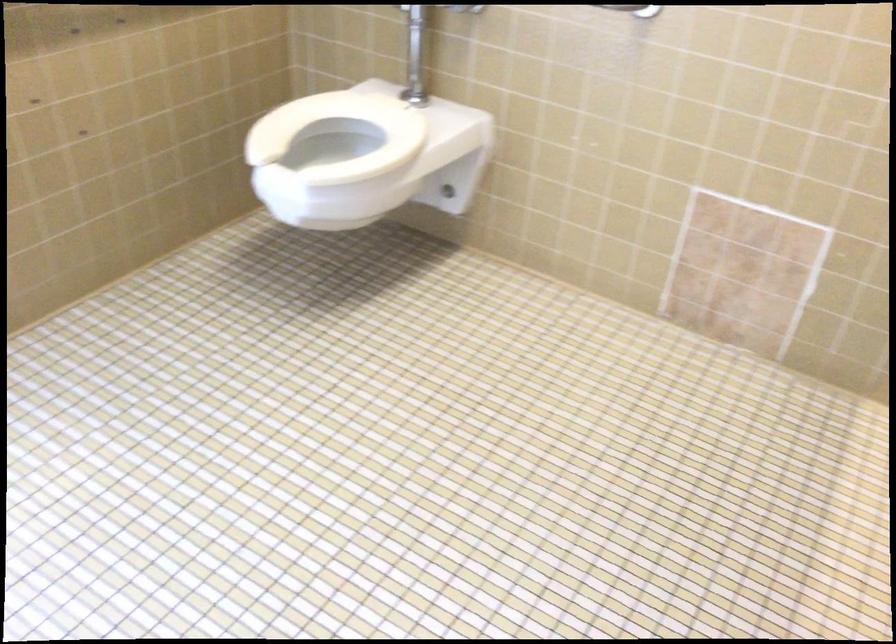
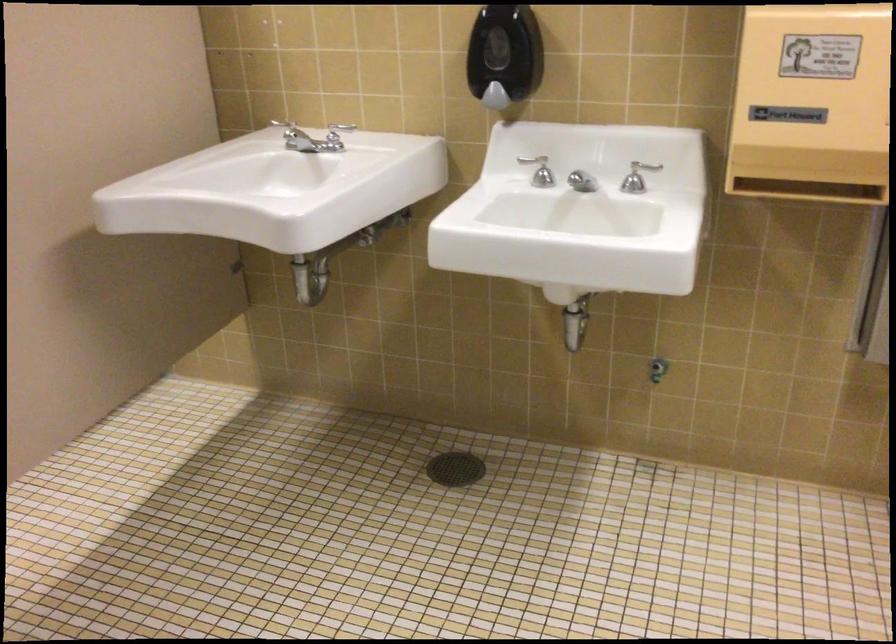
What movement of the cameraman would produce the second image?

The movement direction of the cameraman is right, backward.